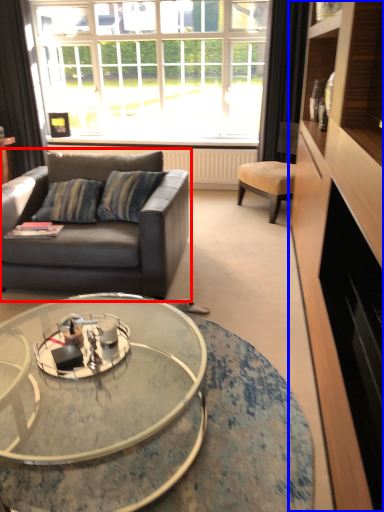
Question: Which object appears farthest to the camera in this image, studio couch (highlighted by a red box) or cabinetry (highlighted by a blue box)?

Choices:
 (A) studio couch
 (B) cabinetry

Answer: (A)